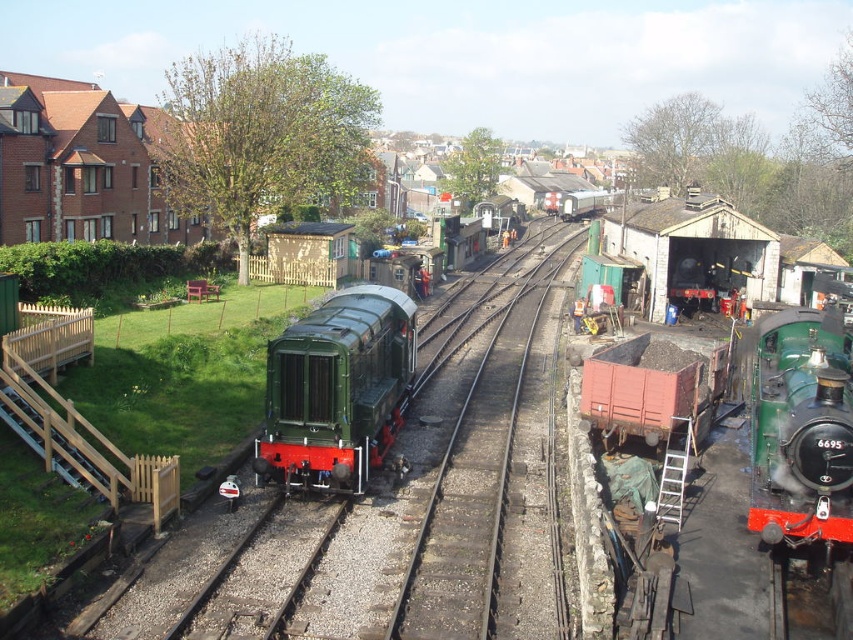
Is point (761, 339) positioned behind point (392, 612)?

Yes, it is.

What do you see at coordinates (801, 428) in the screenshot? I see `green polished wood train at right` at bounding box center [801, 428].

Which is behind, point (838, 413) or point (461, 429)?

The point (461, 429) is more distant.

Locate an element on the screen. This screenshot has height=640, width=853. green polished wood train at right is located at coordinates (801, 428).

Between green polished metal train at center and rustic wood coal wagon at center right, which one has more height?

green polished metal train at center is taller.

From the picture: Which is below, green polished metal train at center or rustic wood coal wagon at center right?

rustic wood coal wagon at center right is below.

Who is more distant from viewer, (x=271, y=340) or (x=628, y=342)?

The point (x=628, y=342) is behind.

Locate an element on the screen. The height and width of the screenshot is (640, 853). green polished metal train at center is located at coordinates (335, 388).

Between point (265, 387) and point (842, 513), which one is positioned behind?

The point (265, 387) is behind.

Does green polished metal train at center appear on the right side of green polished wood train at right?

No, green polished metal train at center is not to the right of green polished wood train at right.

Does point (283, 428) come behind point (817, 401)?

Yes, point (283, 428) is behind point (817, 401).

You are a GUI agent. You are given a task and a screenshot of the screen. Output one action in this format:
    pyautogui.click(x=<x>, y=<y>)
    Task: Click on the green polished metal train at center
    The width and height of the screenshot is (853, 640).
    Given the screenshot: What is the action you would take?
    pyautogui.click(x=335, y=388)